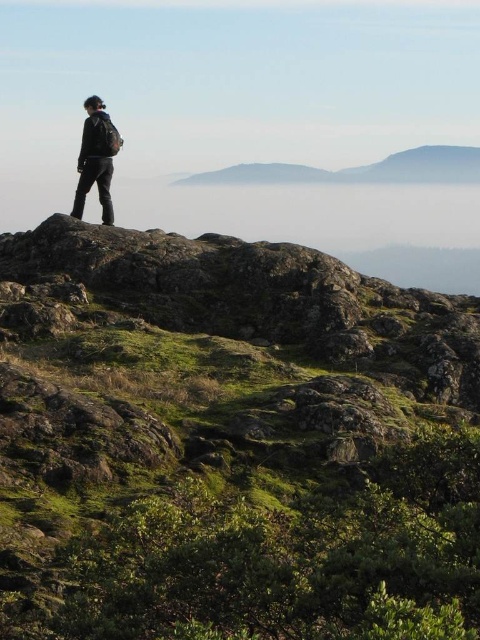
You are a hiker trying to navigate to the smooth gray mountain at center. Based on the coordinates provided in the description, which direction should you head from your current position at the rocky outcrop?

The smooth gray mountain at center is located at coordinates point (360, 170). Since you are on the rocky outcrop, you should head towards the coordinates to reach the mountain.

You are standing at the base of the rocky outcrop and want to reach the point marked at coordinates point (x=278, y=548). Given that the terrain is uneven and rocky, can you estimate how far you need to walk to reach that point?

The point (x=278, y=548) is 4.34 meters away from the viewer, so you need to walk approximately 4.34 meters to reach it.

You are a hiker trying to navigate the terrain. You see the green mossy rock at upper left and the smooth gray mountain at center. Which object is nearer to you?

The green mossy rock at upper left is closer to the viewer than the smooth gray mountain at center.